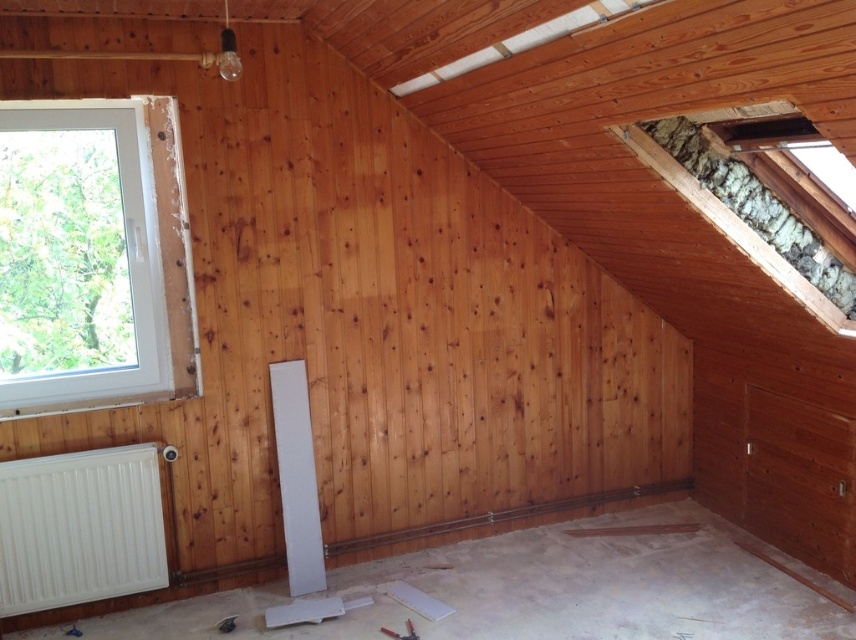
Question: Which is farther from the white matte radiator at lower left?

Choices:
 (A) metallic silver tool at lower center
 (B) white matte beam at center

Answer: (A)

Question: Is white plastic window at left closer to camera compared to metallic silver tool at lower center?

Choices:
 (A) no
 (B) yes

Answer: (A)

Question: Can you confirm if white matte radiator at lower left is positioned to the left of metallic silver tool at lower center?

Choices:
 (A) no
 (B) yes

Answer: (B)

Question: Which point is closer to the camera taking this photo?

Choices:
 (A) (395, 634)
 (B) (12, 486)
 (C) (16, 344)

Answer: (B)

Question: Which object is positioned closest to the white matte radiator at lower left?

Choices:
 (A) white matte beam at center
 (B) white plastic window at left

Answer: (B)

Question: Is white plastic window at left closer to camera compared to white matte radiator at lower left?

Choices:
 (A) no
 (B) yes

Answer: (A)